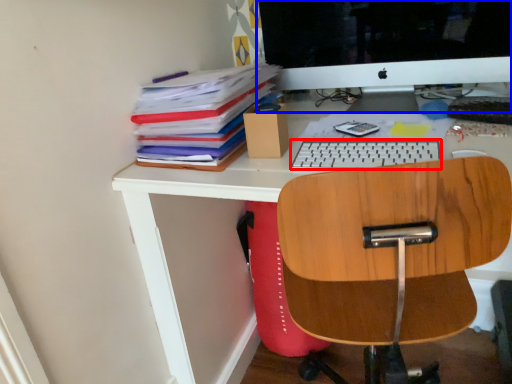
Question: Which of the following is the farthest to the observer, keyboard (highlighted by a red box) or computer monitor (highlighted by a blue box)?

Choices:
 (A) keyboard
 (B) computer monitor

Answer: (B)